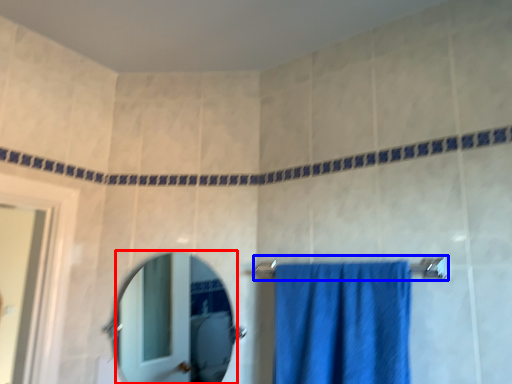
Question: Which object is closer to the camera taking this photo, mirror (highlighted by a red box) or towel bar (highlighted by a blue box)?

Choices:
 (A) mirror
 (B) towel bar

Answer: (B)